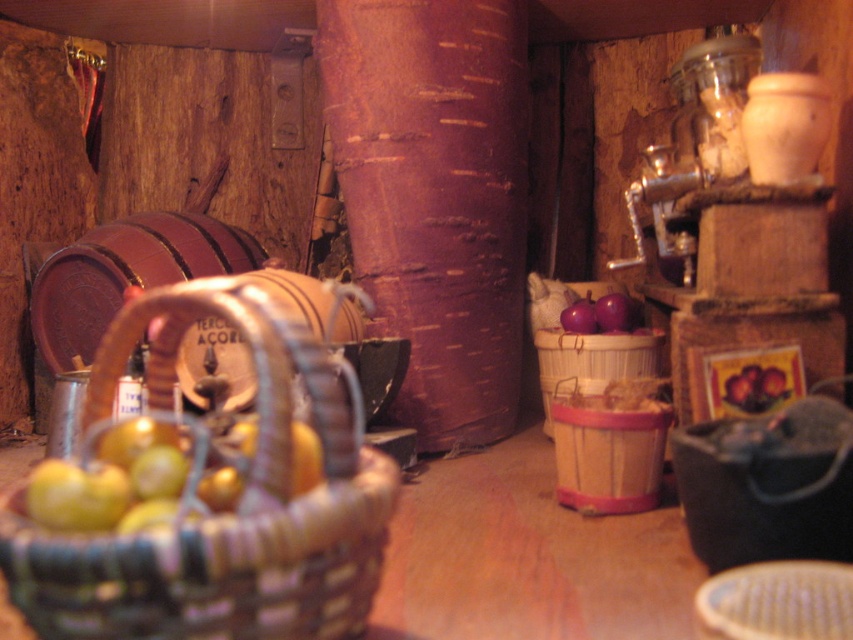
Question: Is wooden woven basket at center smaller than purple matte apple at center-right?

Choices:
 (A) yes
 (B) no

Answer: (B)

Question: Is wooden woven basket at center closer to the viewer compared to purple matte apple at center-right?

Choices:
 (A) no
 (B) yes

Answer: (B)

Question: Is wooden woven basket at center in front of purple matte apple at center-right?

Choices:
 (A) no
 (B) yes

Answer: (B)

Question: Which is farther from the purple matte apple at center-right?

Choices:
 (A) wooden woven basket at center
 (B) woven brown basket at center

Answer: (B)

Question: Which point is farther to the camera?

Choices:
 (A) wooden woven basket at center
 (B) woven brown basket at center
 (C) purple matte apple at center-right

Answer: (C)

Question: Which of the following is the closest to the observer?

Choices:
 (A) woven brown basket at center
 (B) wooden woven basket at center
 (C) purple matte apple at center-right

Answer: (A)